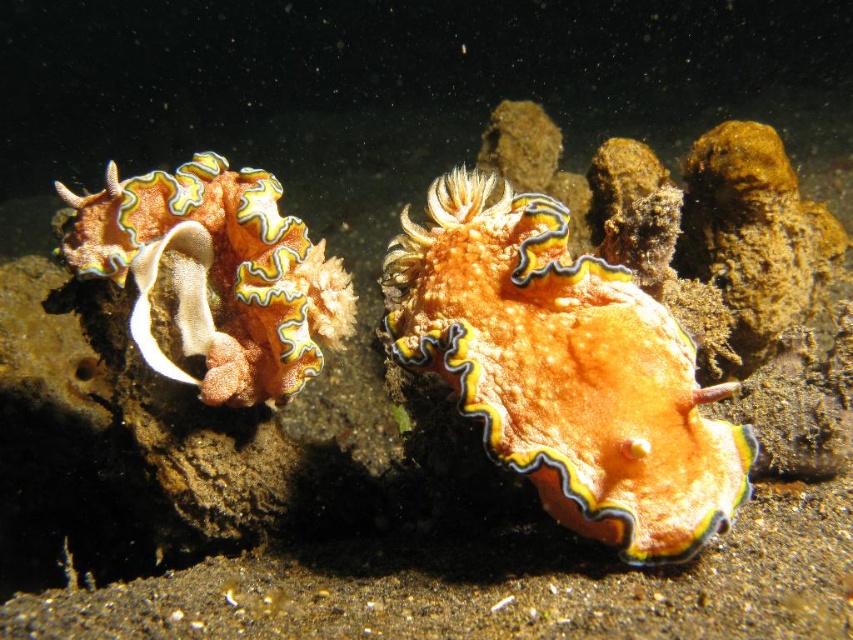
You are a marine biologist diving in the deep sea. You notice an orange matte sea slug at center and an orange matte coral at left. You need to collect a sample from the coral without disturbing the sea slug. Based on their distance, is it possible to reach the coral without getting too close to the sea slug?

The orange matte sea slug at center and orange matte coral at left are 13.26 inches apart. Since 13.26 inches is a sufficient distance, you can collect the coral sample without getting too close to the sea slug.

You are a marine biologist using a remotely operated vehicle to observe underwater life. Your vehicle is currently positioned 5 feet away from the orange matte sea slug at center. Can you safely approach the sea slug for a closer inspection without disturbing it, considering the recommended safe distance is 3 feet?

The orange matte sea slug at center is 3.70 feet away from the camera. Since your vehicle is 5 feet away, you can safely approach it to within the recommended 3 feet distance without disturbing the sea slug.

You are a marine biologist studying underwater creatures. You observe an orange matte sea slug at center and an orange matte coral at left in the image. Which object is wider?

The orange matte sea slug at center is wider than the orange matte coral at left.